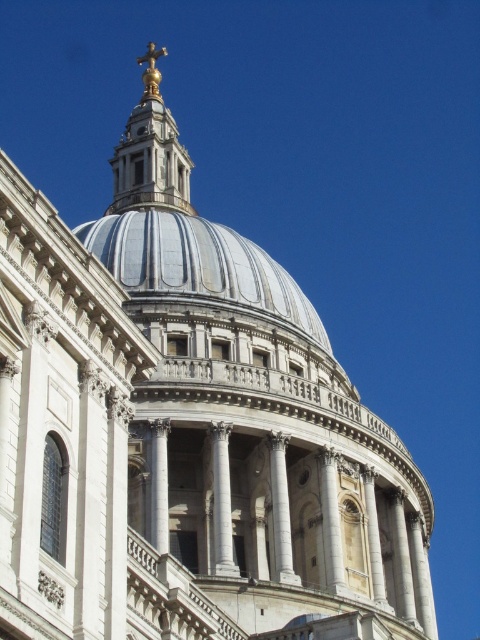
Does white marble dome at center have a greater width compared to gold metallic cross at top?

Incorrect, white marble dome at center's width does not surpass gold metallic cross at top's.

Between point (111, 230) and point (136, 108), which one is positioned in front?

Point (111, 230) is in front.

Identify the location of white marble dome at center. The width and height of the screenshot is (480, 640). (199, 266).